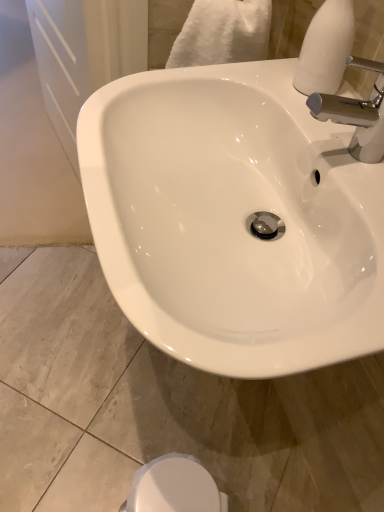
This screenshot has height=512, width=384. Identify the location of vacant space to the right of white glossy bidet at lower center. (244, 474).